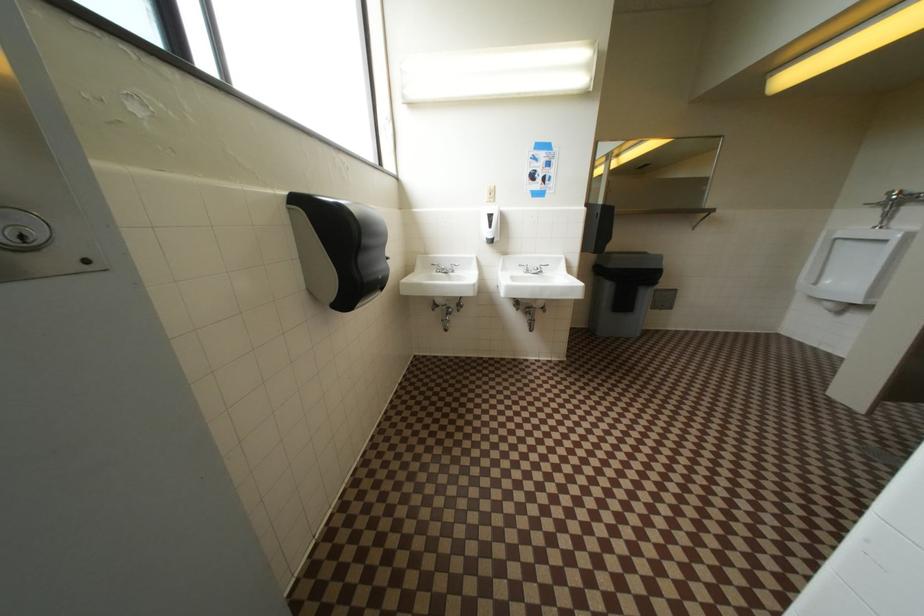
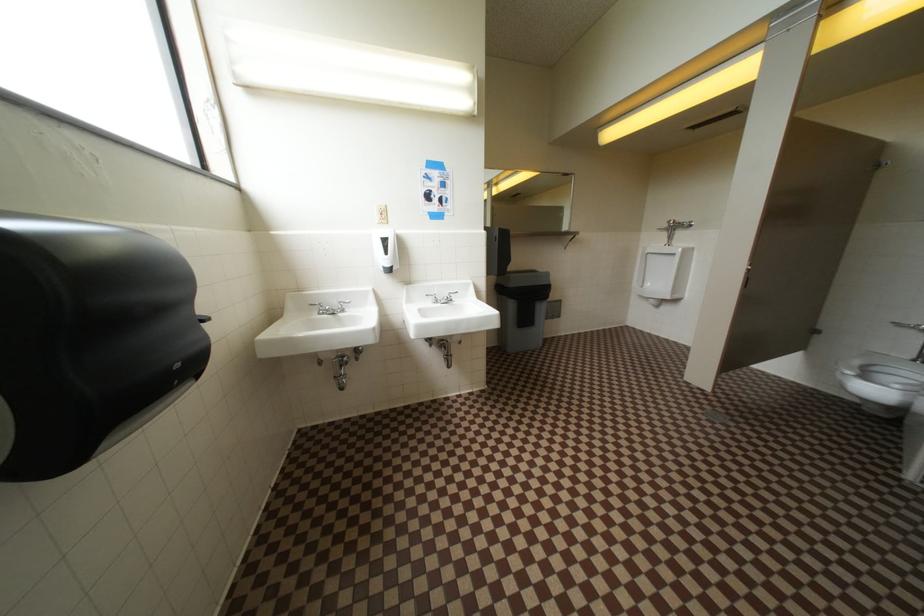
Question: The first image is from the beginning of the video and the second image is from the end. How did the camera likely rotate when shooting the video?

Choices:
 (A) Left
 (B) Right
 (C) Up
 (D) Down

Answer: (B)